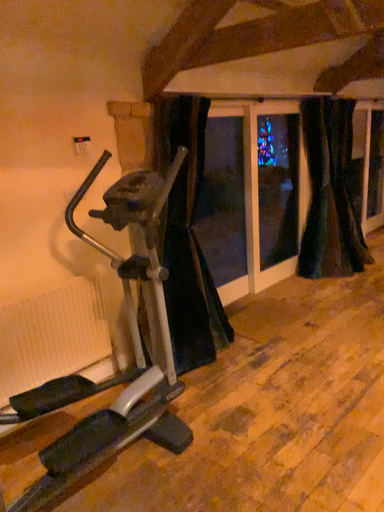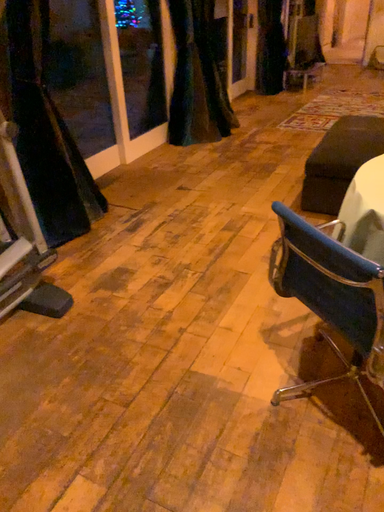
Question: Which way did the camera rotate in the video?

Choices:
 (A) rotated right
 (B) rotated left

Answer: (A)